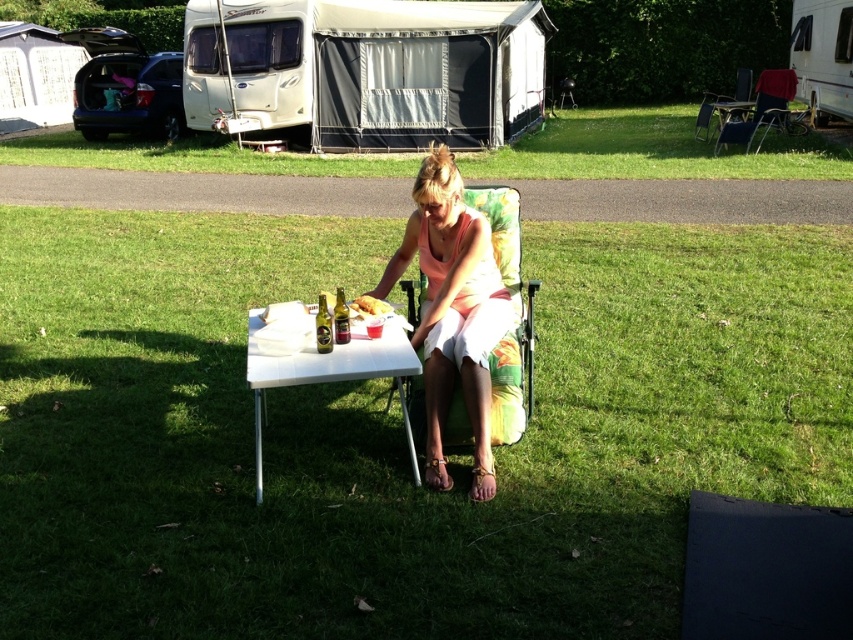
Does matte peach tank top at center appear on the left side of metallic gold can at center?

No, matte peach tank top at center is not to the left of metallic gold can at center.

Can you confirm if matte peach tank top at center is shorter than metallic gold can at center?

In fact, matte peach tank top at center may be taller than metallic gold can at center.

This screenshot has height=640, width=853. I want to click on matte peach tank top at center, so click(451, 310).

Identify the location of matte peach tank top at center. This screenshot has height=640, width=853. (451, 310).

What do you see at coordinates (367, 68) in the screenshot?
I see `white fabric camper at upper center` at bounding box center [367, 68].

Between point (289, 116) and point (815, 52), which one is positioned behind?

The point (815, 52) is behind.

Where is `white fabric camper at upper center`? Image resolution: width=853 pixels, height=640 pixels. white fabric camper at upper center is located at coordinates (367, 68).

Between point (343, 340) and point (358, 300), which one is positioned in front?

Point (343, 340)

Between translucent glass bottle at center and golden brown bread at center, which one is positioned lower?

translucent glass bottle at center is below.

Which is in front, point (343, 296) or point (375, 314)?

Point (375, 314) is in front.

The image size is (853, 640). I want to click on translucent glass bottle at center, so click(340, 317).